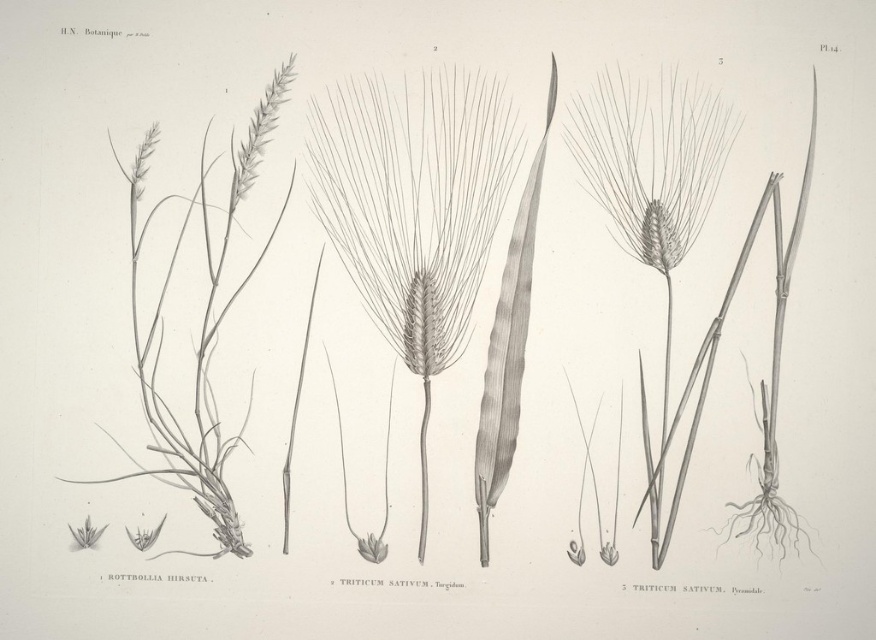
You are a botanist examining the botanical illustration. The gray textured wheat ear at center is part of which plant species? Is it Rottbollia Hirsuta, the first Triticum Sativum, or the second Triticum Sativum?

The gray textured wheat ear at center is part of the second Triticum Sativum labeled as 3 because it is positioned at point (414, 200), which corresponds to the center area of the image where the second Triticum Sativum is located.

Looking at this image, you are a botanist examining two wheat ears in the image. The gray textured wheat ear at center and the smooth gray wheat ear at center. Which one is bigger?

The gray textured wheat ear at center is larger than the smooth gray wheat ear at center.